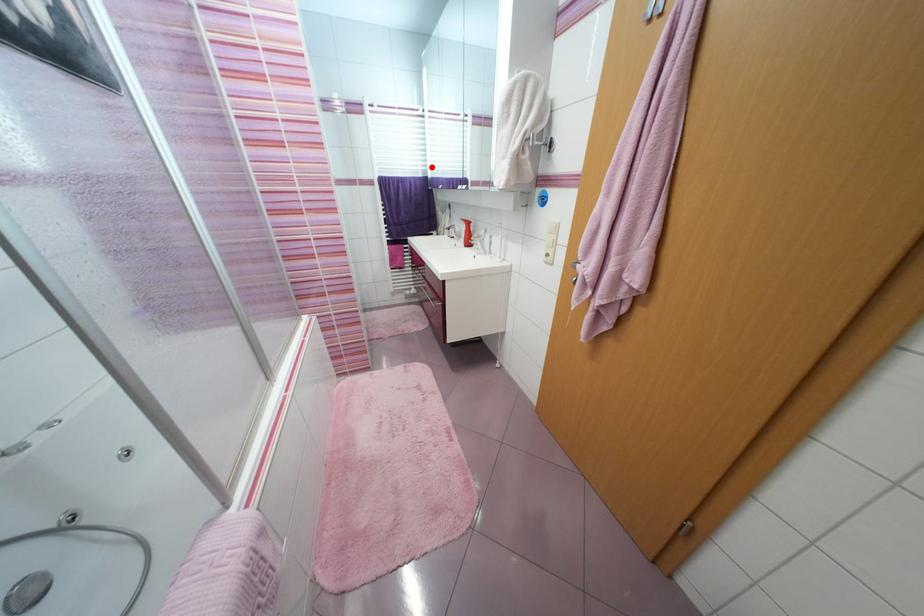
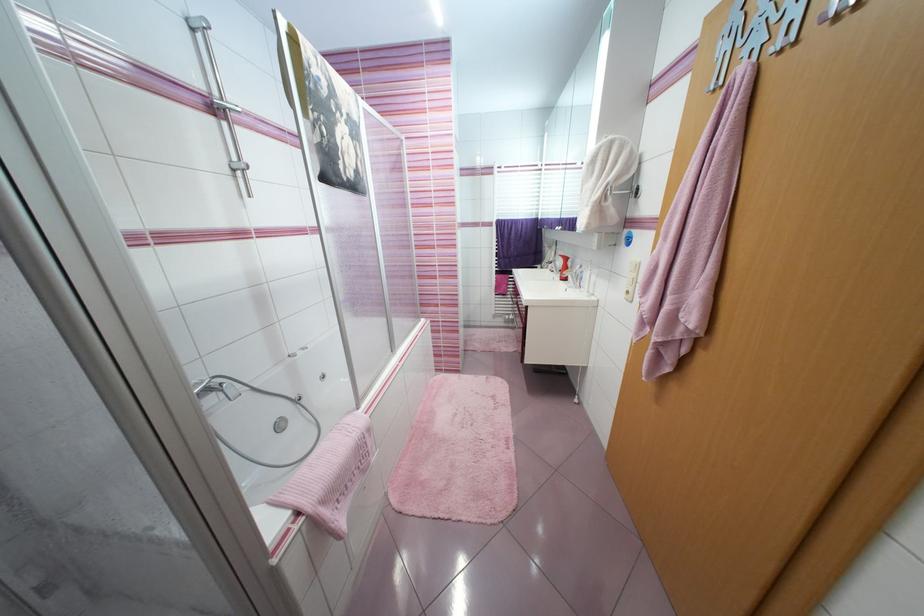
In the second image, find the point that corresponds to the highlighted location in the first image.

(543, 211)